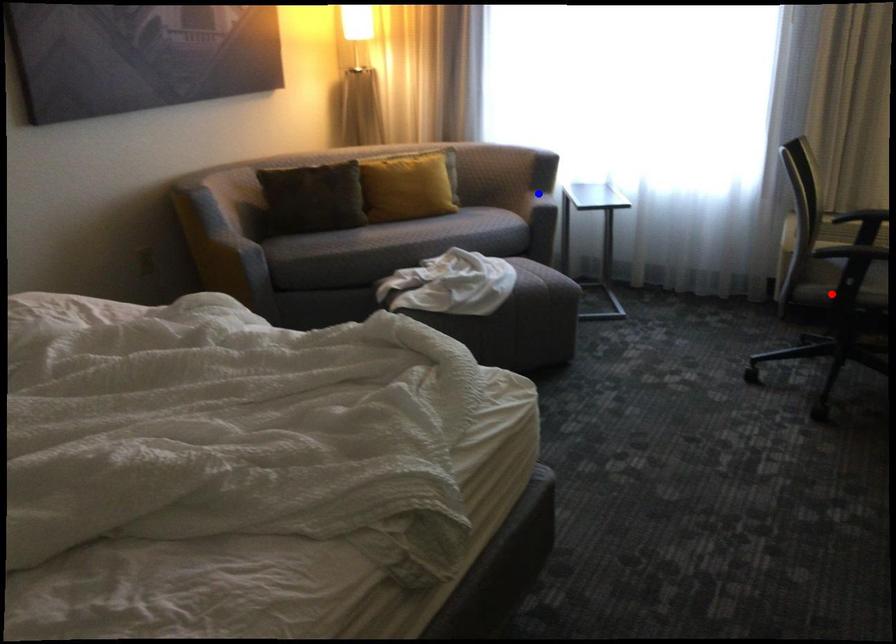
Question: Two points are marked on the image. Which point is closer to the camera?

Choices:
 (A) Blue point is closer.
 (B) Red point is closer.

Answer: (B)